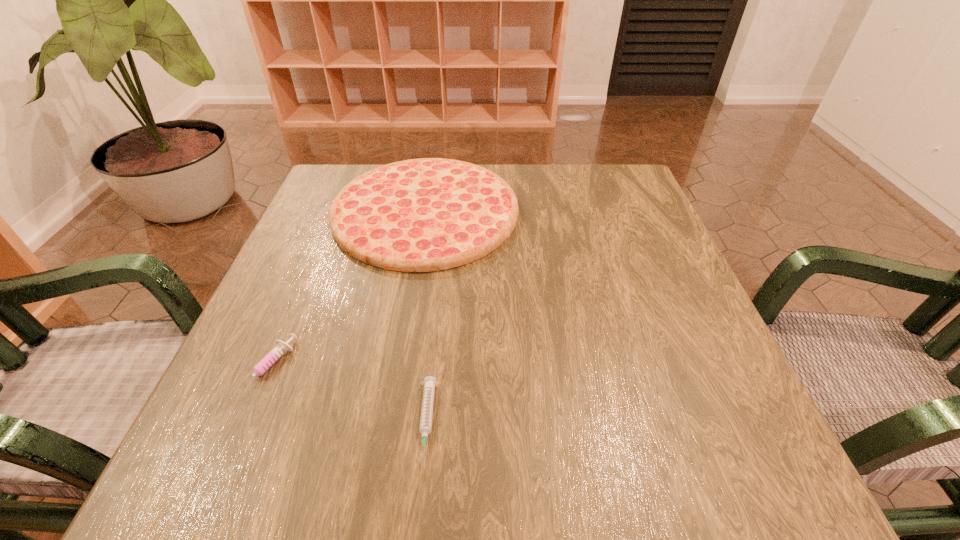
Where is `object that is at the far left corner`? This screenshot has width=960, height=540. object that is at the far left corner is located at coordinates (419, 215).

In the image, there is a desktop. In order to click on free region at the far edge in this screenshot , I will do `click(552, 200)`.

Find the location of a particular element. Image resolution: width=960 pixels, height=540 pixels. free point at the near edge is located at coordinates (398, 485).

The image size is (960, 540). What are the coordinates of `free space at the left edge of the desktop` in the screenshot? It's located at (317, 364).

In the image, there is a desktop. Where is `free space at the right edge`? free space at the right edge is located at coordinates (711, 393).

Where is `free space at the far left corner of the desktop`? The height and width of the screenshot is (540, 960). free space at the far left corner of the desktop is located at coordinates (352, 177).

Locate an element on the screen. The image size is (960, 540). vacant space at the far right corner of the desktop is located at coordinates (603, 175).

Where is `empty location between the right syringe and the pizza`? empty location between the right syringe and the pizza is located at coordinates (426, 316).

The height and width of the screenshot is (540, 960). In order to click on free spot between the right syringe and the farthest object in this screenshot , I will do `click(426, 316)`.

This screenshot has width=960, height=540. I want to click on blank region between the farthest object and the left syringe, so click(347, 290).